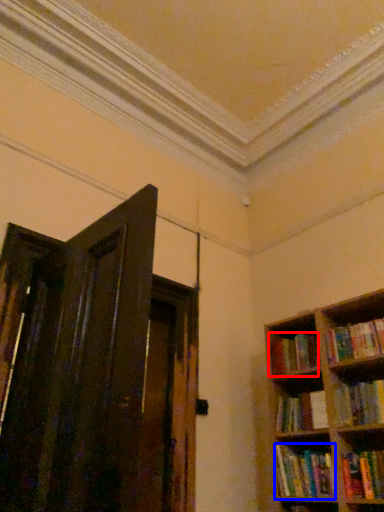
Question: Which object appears farthest to the camera in this image, book (highlighted by a red box) or book (highlighted by a blue box)?

Choices:
 (A) book
 (B) book

Answer: (A)